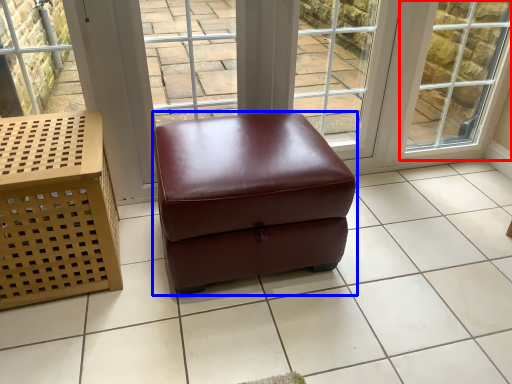
Question: Which object appears farthest to the camera in this image, window (highlighted by a red box) or stool (highlighted by a blue box)?

Choices:
 (A) window
 (B) stool

Answer: (A)